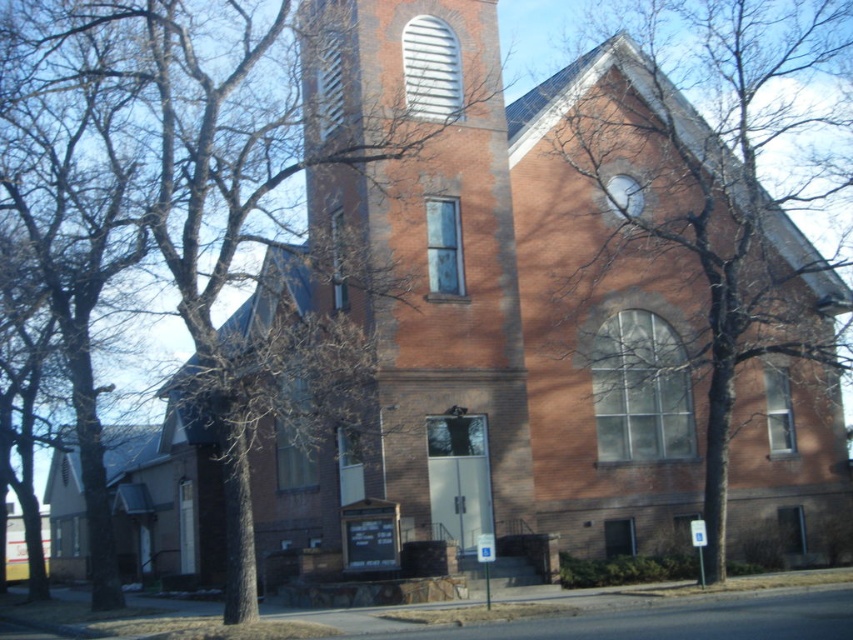
Between point (350, 237) and point (729, 342), which one is positioned behind?

Positioned behind is point (350, 237).

Who is positioned more to the right, brown bark tree at upper left or brown bark tree at right?

From the viewer's perspective, brown bark tree at right appears more on the right side.

What do you see at coordinates (413, 202) in the screenshot?
I see `brown bark tree at upper left` at bounding box center [413, 202].

This screenshot has width=853, height=640. I want to click on brown bark tree at upper left, so click(x=413, y=202).